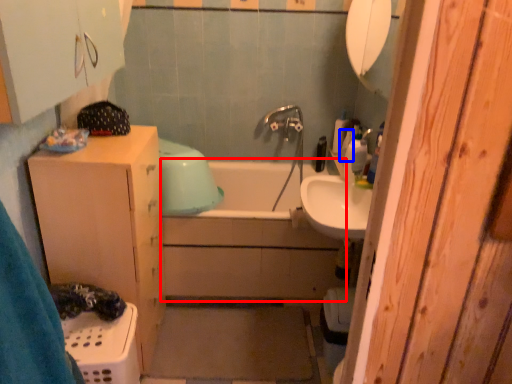
Question: Which object appears closest to the camera in this image, bath (highlighted by a red box) or toiletry (highlighted by a blue box)?

Choices:
 (A) bath
 (B) toiletry

Answer: (A)